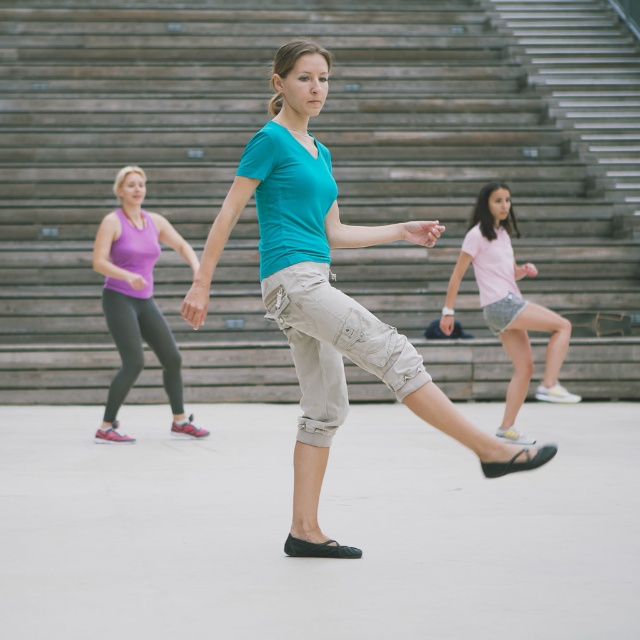
You are standing at point (332, 163) in the image. What object is directly beneath your feet?

The wooden stairs at center are directly beneath the point (332, 163).

You are designing a group costume for a dance performance and need to ensure that all outfits have similar widths to maintain uniformity. Given the purple fabric tank top at left and the light pink cotton shorts at center, which one might need adjustment to match the other in width?

The purple fabric tank top at left is narrower than the light pink cotton shorts at center, so the tank top would need to be widened to match the shorts.

You are a photographer trying to capture the entire scene of the dance class. You notice the wooden stairs at center and the purple fabric tank top at left. Which object would require more horizontal space in your photo frame?

The wooden stairs at center would require more horizontal space in the photo frame because its width is larger than the purple fabric tank top at left.